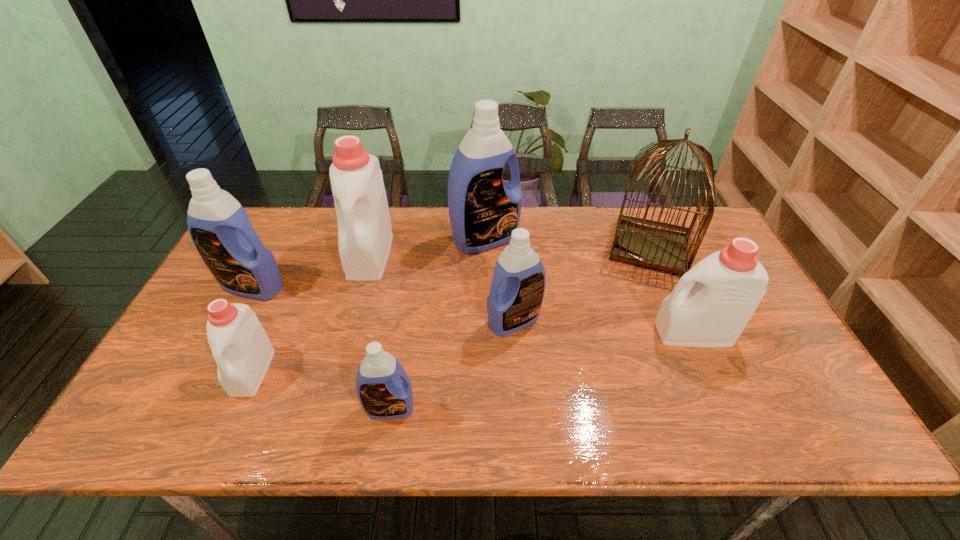
Find the location of `free space located on the handle side of the second smallest white detergent`. free space located on the handle side of the second smallest white detergent is located at coordinates (507, 333).

Locate an element on the screen. This screenshot has height=540, width=960. free location located 0.090m on the handle side of the leftmost white detergent is located at coordinates (224, 436).

This screenshot has width=960, height=540. I want to click on free region located 0.250m on the right of the nearest blue detergent, so click(x=525, y=408).

Image resolution: width=960 pixels, height=540 pixels. I want to click on birdcage that is at the far edge, so click(x=655, y=245).

Where is `object that is positioned at the near edge`? object that is positioned at the near edge is located at coordinates (383, 394).

This screenshot has height=540, width=960. What are the coordinates of `object that is at the left edge` in the screenshot? It's located at (219, 226).

Find the location of a particular element. birdcage located in the right edge section of the desktop is located at coordinates click(x=655, y=245).

I want to click on detergent that is at the right edge, so click(725, 288).

Where is `object that is positioned at the far right corner`? The width and height of the screenshot is (960, 540). object that is positioned at the far right corner is located at coordinates (655, 245).

At what (x,y) coordinates should I click in order to perform the action: click on vacant space at the far edge of the desktop. Please return your answer as a coordinate pair (x, y). This screenshot has height=540, width=960. Looking at the image, I should click on [558, 238].